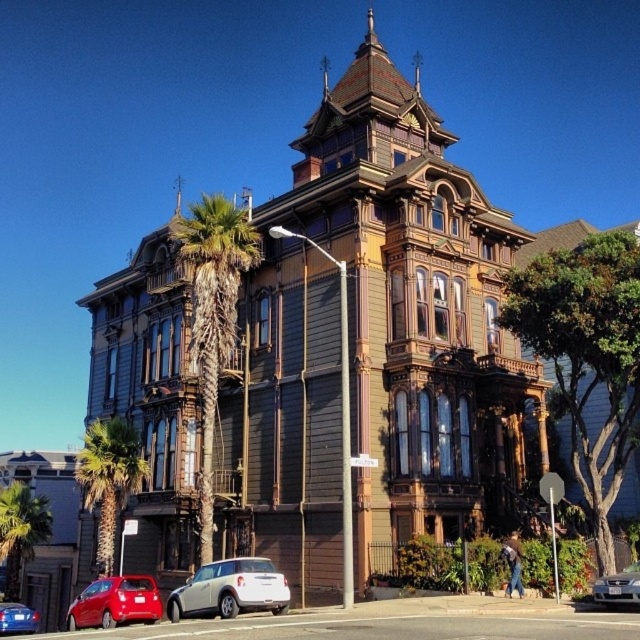
Question: Which object appears farthest from the camera in this image?

Choices:
 (A) green leafy palm tree at center
 (B) metallic blue sedan at lower left
 (C) white matte car at lower center
 (D) green leafy palm tree at lower left

Answer: (D)

Question: Is green leafy palm tree at left bigger than green leafy palm tree at lower left?

Choices:
 (A) no
 (B) yes

Answer: (B)

Question: Which object appears farthest from the camera in this image?

Choices:
 (A) metallic blue sedan at lower left
 (B) green leafy palm tree at lower left

Answer: (B)

Question: Is green leafy palm tree at lower left smaller than silver metallic sedan at lower right?

Choices:
 (A) no
 (B) yes

Answer: (A)

Question: Which object is positioned closest to the silver metallic sedan at lower right?

Choices:
 (A) metallic blue sedan at lower left
 (B) green leafy palm tree at lower left
 (C) green leafy palm tree at left

Answer: (A)

Question: Can you confirm if green leafy palm tree at center is positioned to the right of green leafy palm tree at left?

Choices:
 (A) yes
 (B) no

Answer: (A)